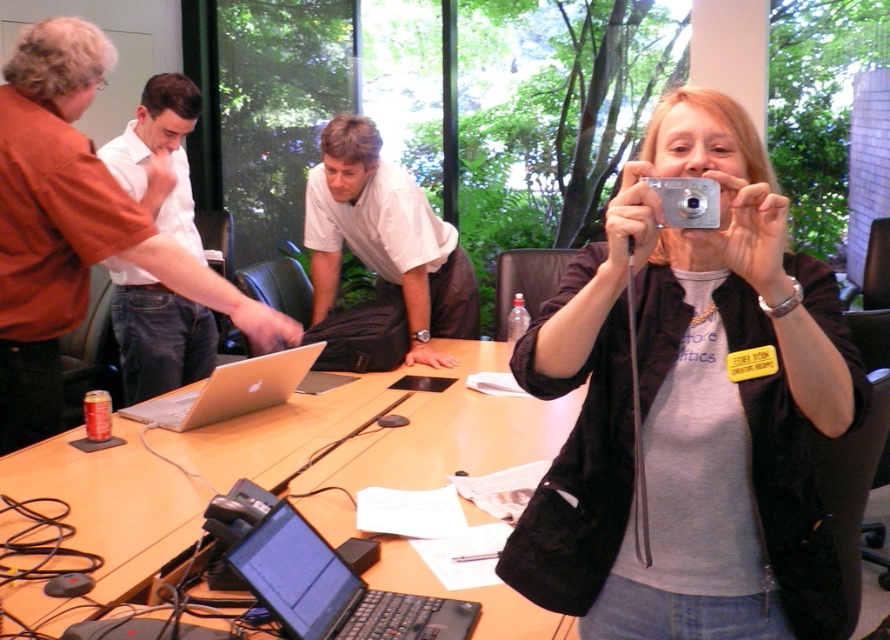
Can you confirm if black plastic laptop at lower center is positioned below silver metallic camera at upper center?

Yes, black plastic laptop at lower center is below silver metallic camera at upper center.

Is black plastic laptop at lower center closer to the viewer compared to silver metallic camera at upper center?

No, it is not.

Is point (276, 552) in front of point (662, 221)?

That is False.

This screenshot has width=890, height=640. I want to click on black plastic laptop at lower center, so click(x=333, y=588).

Looking at this image, can you confirm if white matte shirt at center is smaller than silver metallic laptop at center?

A: No, white matte shirt at center is not smaller than silver metallic laptop at center.

Who is more forward, (448, 307) or (136, 413)?

Point (136, 413) is more forward.

Is point (392, 224) in front of point (217, 417)?

No, it is not.

Find the location of a particular element. white matte shirt at center is located at coordinates click(x=384, y=241).

Who is more distant from viewer, (678, 456) or (227, 401)?

Positioned behind is point (227, 401).

Is point (726, 289) positioned in front of point (274, 365)?

Yes, point (726, 289) is closer to viewer.

At what (x,y) coordinates should I click in order to perform the action: click on silver metallic camera at center. Please return your answer as a coordinate pair (x, y). This screenshot has height=640, width=890. Looking at the image, I should click on (689, 406).